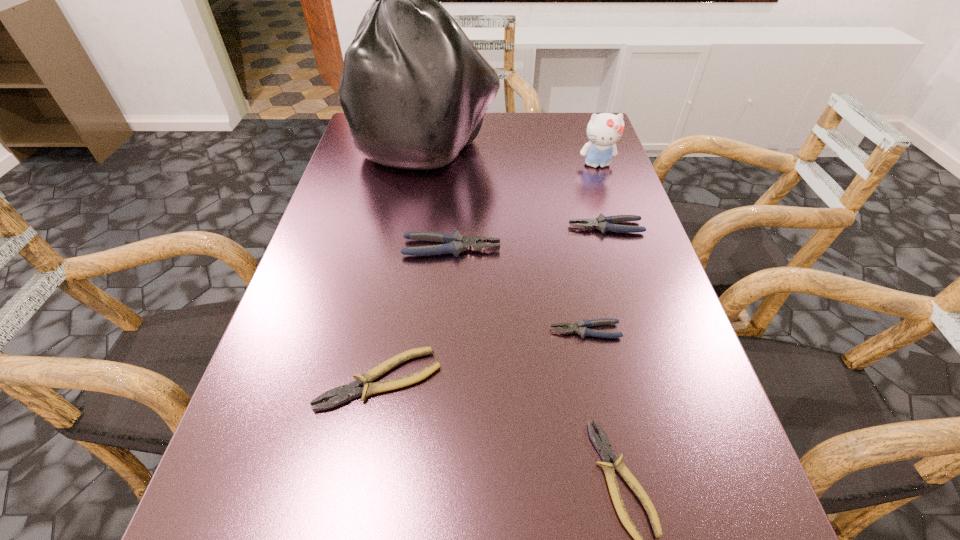
Choose which yellow pliers is the nearest neighbor to the tallest object. Please provide its 2D coordinates. Your answer should be formatted as a tuple, i.e. [(x, y)], where the tuple contains the x and y coordinates of a point satisfying the conditions above.

[(346, 392)]

Identify which yellow pliers is the nearest to the plastic bag. Please provide its 2D coordinates. Your answer should be formatted as a tuple, i.e. [(x, y)], where the tuple contains the x and y coordinates of a point satisfying the conditions above.

[(346, 392)]

Locate an element on the screen. Image resolution: width=960 pixels, height=540 pixels. free space that satisfies the following two spatial constraints: 1. at the gripping part of the fourth farthest object; 2. on the front side of the left yellow pliers is located at coordinates (443, 380).

The height and width of the screenshot is (540, 960). In order to click on free space that satisfies the following two spatial constraints: 1. on the front-facing side of the sixth shortest object; 2. at the gripping part of the fourth tallest object in this screenshot , I will do click(x=618, y=227).

In order to click on free space that satisfies the following two spatial constraints: 1. on the front-facing side of the second tallest object; 2. at the gripping part of the fourth shortest object in this screenshot , I will do `click(618, 227)`.